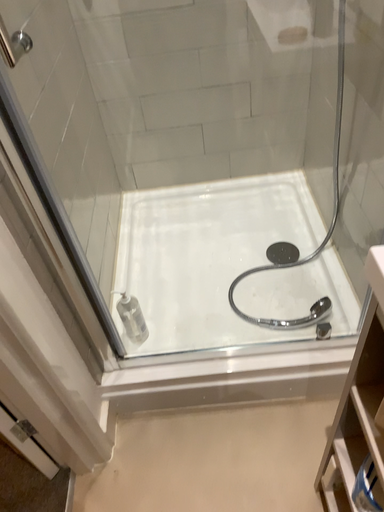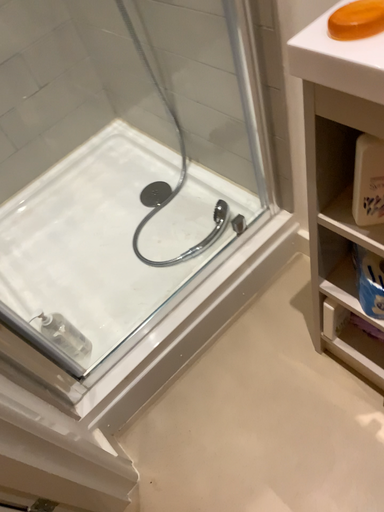
Question: How did the camera likely rotate when shooting the video?

Choices:
 (A) rotated right
 (B) rotated left

Answer: (A)